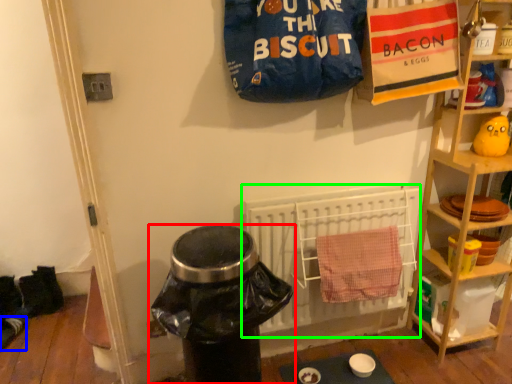
Question: Considering the real-world distances, which object is closest to trash bin/can (highlighted by a red box)? footwear (highlighted by a blue box) or radiator (highlighted by a green box).

Choices:
 (A) footwear
 (B) radiator

Answer: (B)